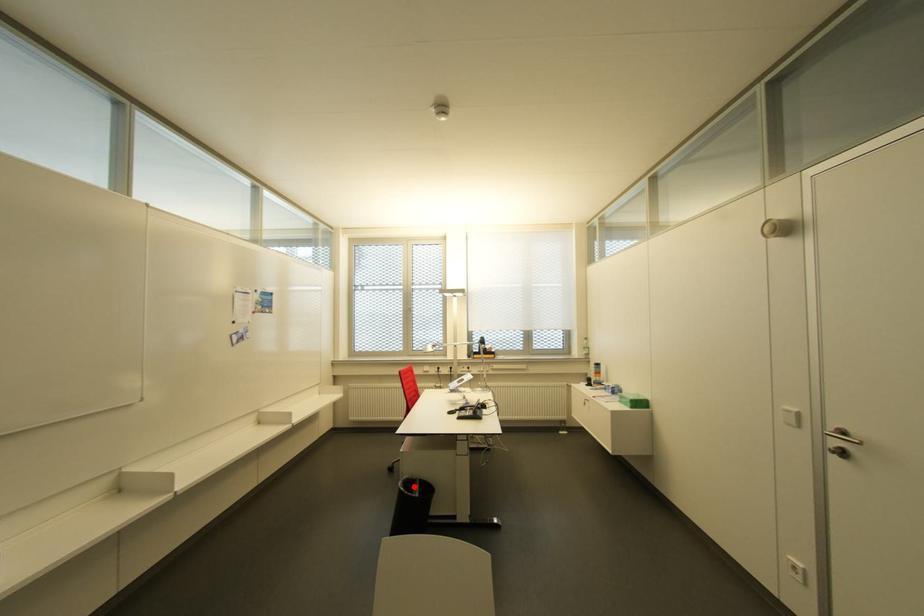
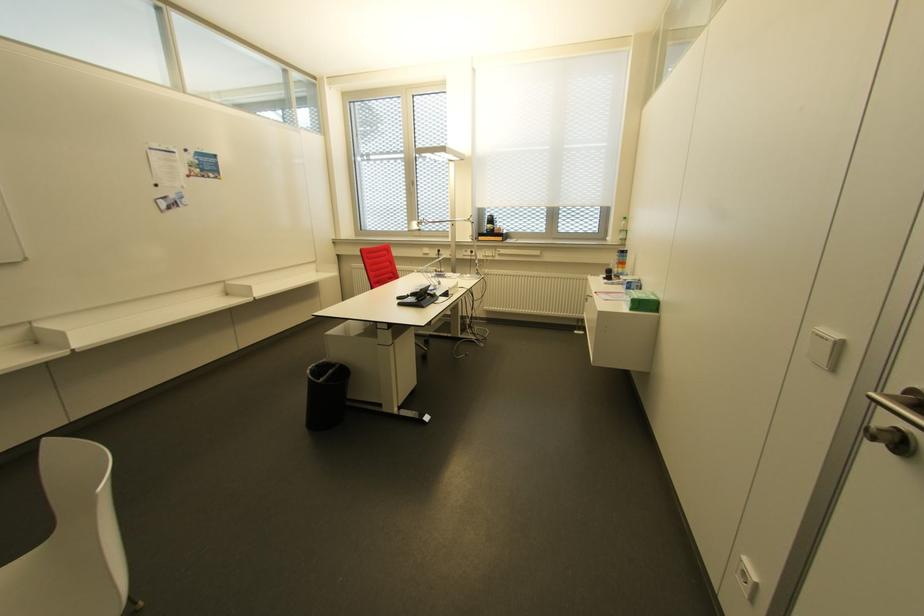
In the second image, find the point that corresponds to the highlighted location in the first image.

(329, 371)